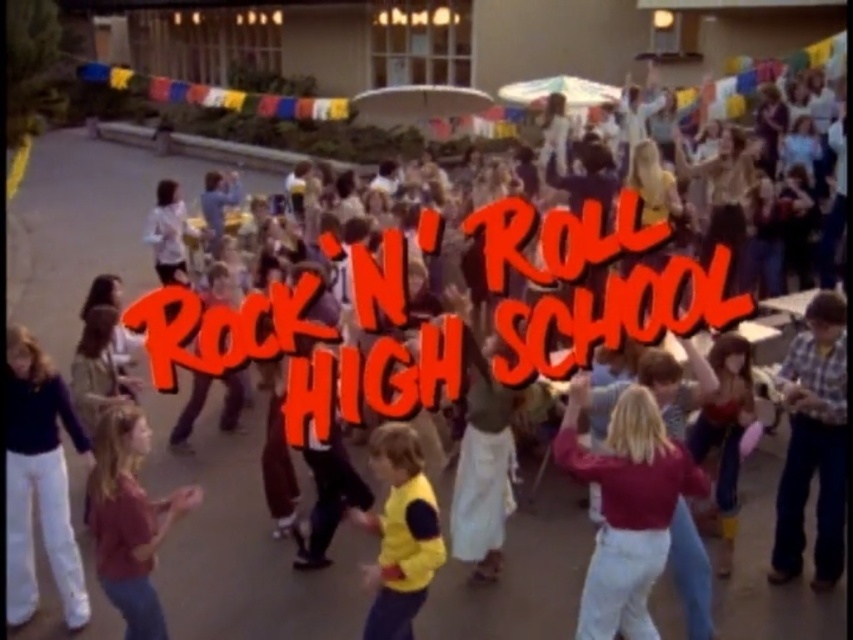
Question: Which of these objects is positioned closest to the yellow fleece vest at center?

Choices:
 (A) matte red sweater at center
 (B) matte pink shirt at center

Answer: (A)

Question: Observing the image, what is the correct spatial positioning of matte pink shirt at center in reference to yellow fleece vest at center?

Choices:
 (A) left
 (B) right

Answer: (A)

Question: Where is matte red sweater at center located in relation to matte pink shirt at center in the image?

Choices:
 (A) right
 (B) left

Answer: (A)

Question: From the image, what is the correct spatial relationship of matte pink shirt at center in relation to yellow fleece vest at center?

Choices:
 (A) above
 (B) below

Answer: (A)

Question: Among these points, which one is farthest from the camera?

Choices:
 (A) (410, 577)
 (B) (100, 513)

Answer: (A)

Question: Which object is positioned farthest from the matte red sweater at center?

Choices:
 (A) yellow fleece vest at center
 (B) matte pink shirt at center

Answer: (B)